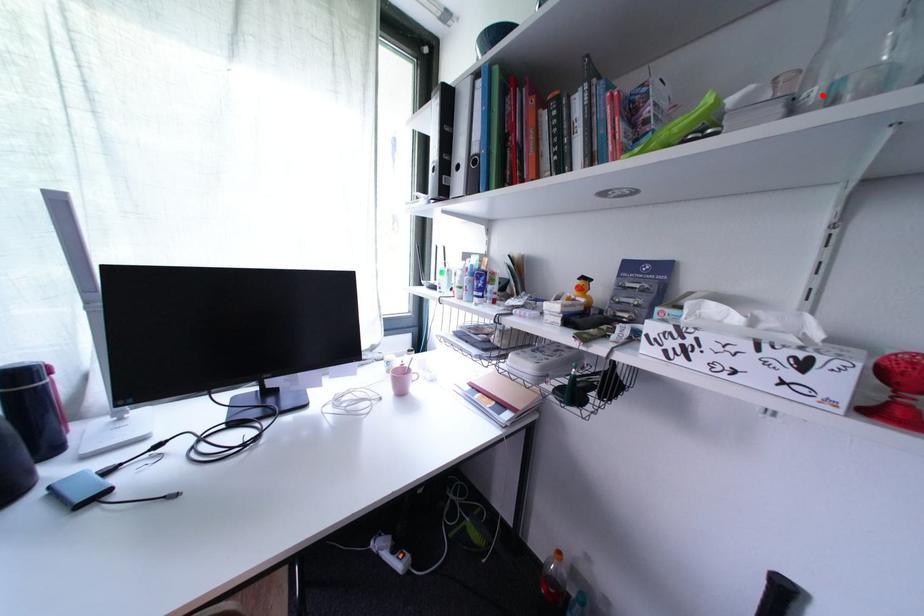
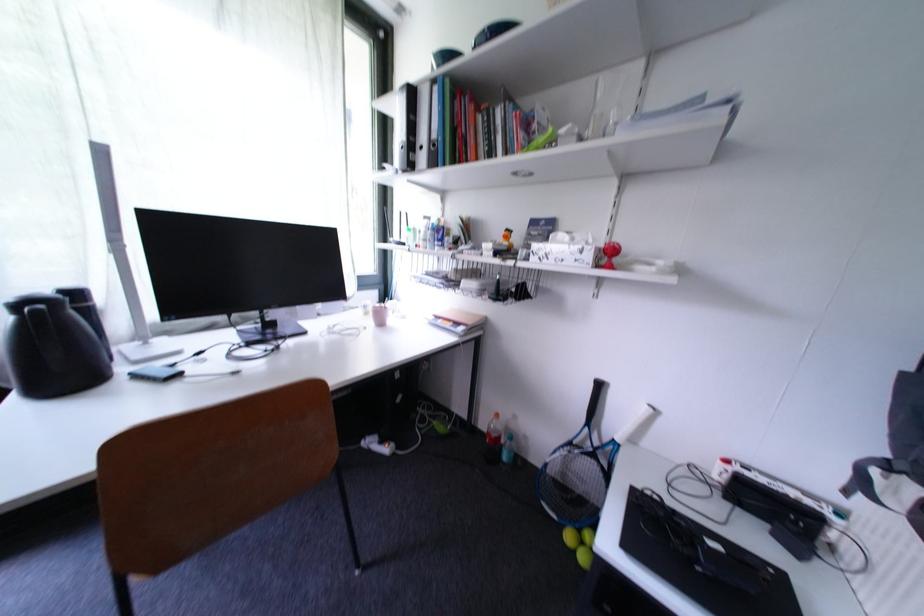
Find the pixel in the second image that matches the highlighted location in the first image.

(594, 136)